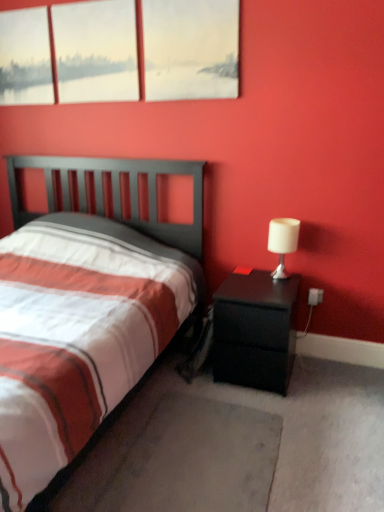
Question: Based on their positions, is matte white canvas at upper left, the 1th window viewed from the left, located to the left or right of gray carpet at lower center?

Choices:
 (A) right
 (B) left

Answer: (B)

Question: In terms of size, does matte white canvas at upper left, the third window viewed from the right, appear bigger or smaller than gray carpet at lower center?

Choices:
 (A) big
 (B) small

Answer: (B)

Question: Estimate the real-world distances between objects in this image. Which object is farther from the black matte nightstand at right?

Choices:
 (A) matte white canvas at upper left, the third window viewed from the right
 (B) matte white painting at upper center, which is counted as the third window, starting from the left
 (C) matte glass window at upper left, which is counted as the second window, starting from the left
 (D) gray carpet at lower center
 (E) white matte table lamp at right

Answer: (A)

Question: Which object is the closest to the white matte table lamp at right?

Choices:
 (A) gray carpet at lower center
 (B) black matte nightstand at right
 (C) matte white canvas at upper left, the third window viewed from the right
 (D) matte white painting at upper center, which is counted as the third window, starting from the left
 (E) matte glass window at upper left, arranged as the second window when viewed from the right

Answer: (B)